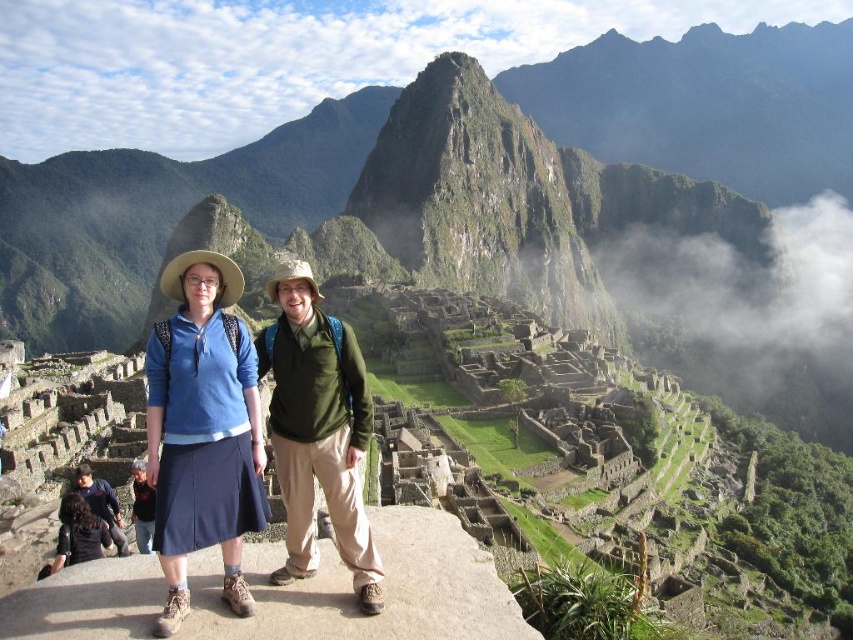
Based on the photo, you are standing at the entrance of Machu Picchu and want to take a photo of the point at coordinates point (769, 160). If your camera has a maximum focus range of 2000 feet, will you be able to capture the point clearly?

The distance of point (769, 160) from the camera is 1937.26 feet, which is within the camera maximum focus range of 2000 feet. Therefore, you can capture the point clearly.

You are a photographer trying to capture a photo of the dark blue skirt at center and the green grassy mountain at center. Which object should you focus on first to ensure both are in sharp focus?

You should focus on the dark blue skirt at center first because it is closer to you than the green grassy mountain at center, which is further away. By focusing on the closer object, the mountain will also be in focus due to the depth of field.